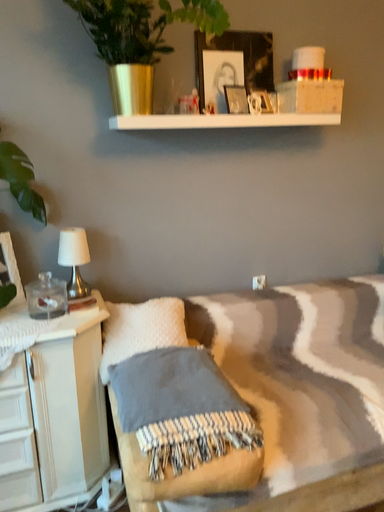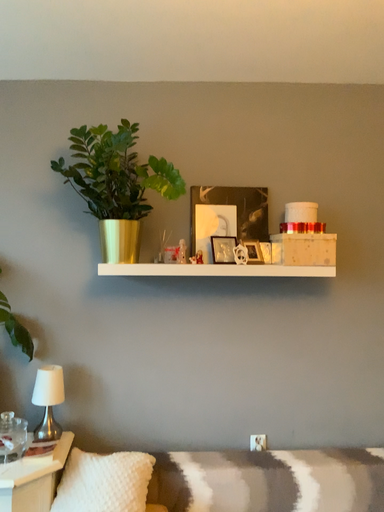
Question: How did the camera likely rotate when shooting the video?

Choices:
 (A) rotated upward
 (B) rotated downward

Answer: (A)